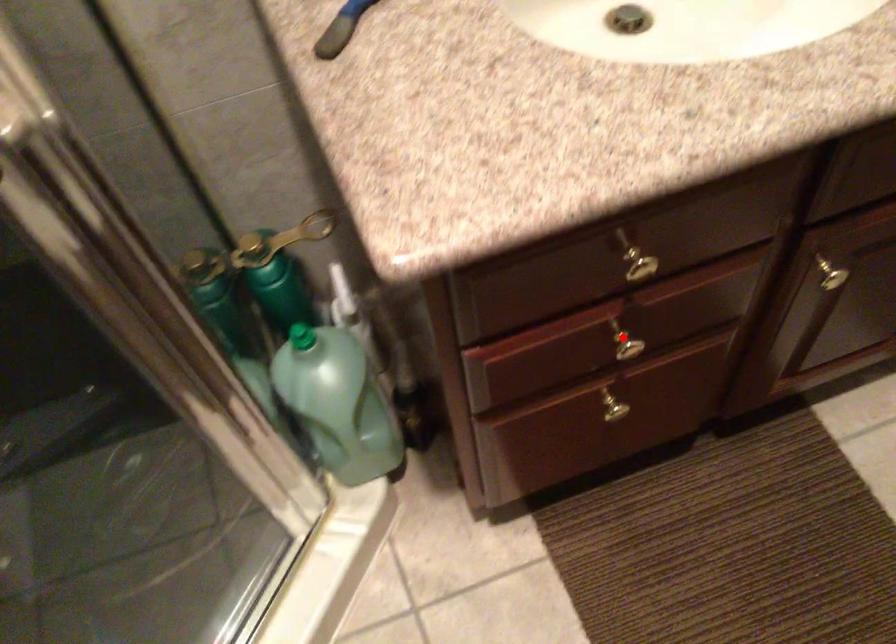
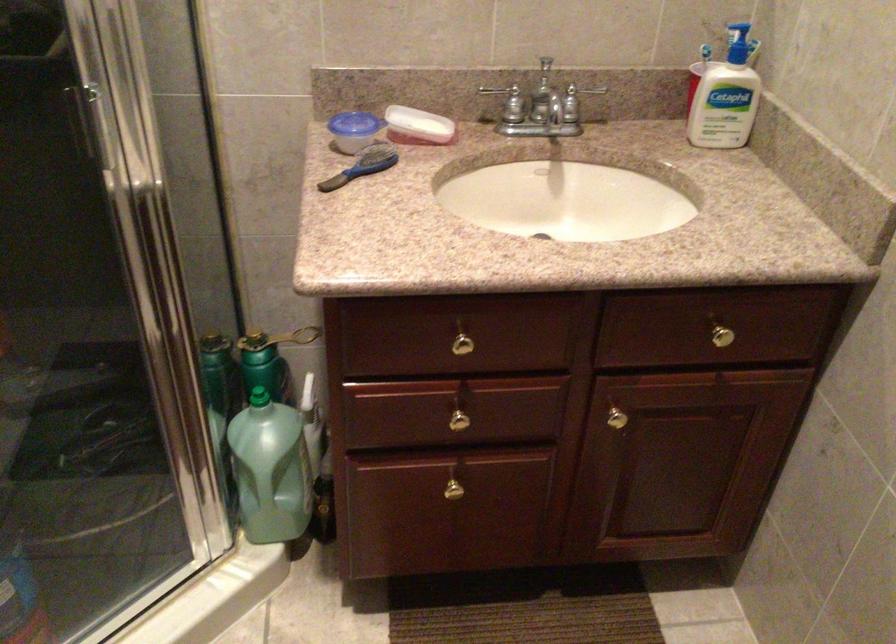
Question: I am providing you with two images of the same scene from different viewpoints. Image1 has a red point marked. In image2, the corresponding 3D location appears at what relative position? Reply with the corresponding letter.

Choices:
 (A) Closer
 (B) Farther

Answer: (B)